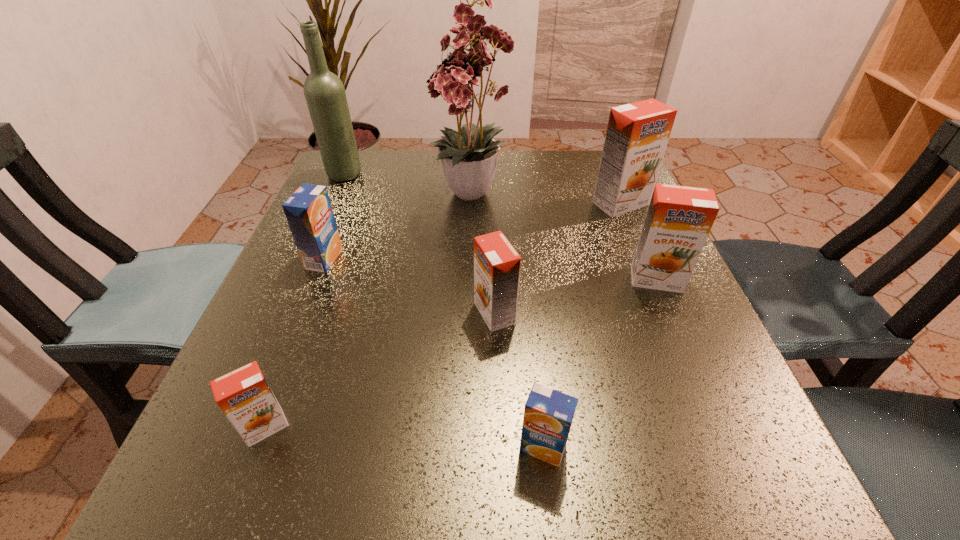
You are a GUI agent. You are given a task and a screenshot of the screen. Output one action in this format:
    pyautogui.click(x=<x>, y=<y>)
    Task: Click on the orange orange juice that is the second nearest to the green wine bottle
    
    Given the screenshot: What is the action you would take?
    [x=637, y=135]

Image resolution: width=960 pixels, height=540 pixels. Find the location of `free point that satisfies the following two spatial constraints: 1. on the front side of the second biggest orange orange juice; 2. on the left side of the biggest orange orange juice`. free point that satisfies the following two spatial constraints: 1. on the front side of the second biggest orange orange juice; 2. on the left side of the biggest orange orange juice is located at coordinates (652, 279).

Locate an element on the screen. The image size is (960, 540). free space that satisfies the following two spatial constraints: 1. on the front side of the nearer blue orange_juice; 2. on the right side of the wine bottle is located at coordinates (225, 447).